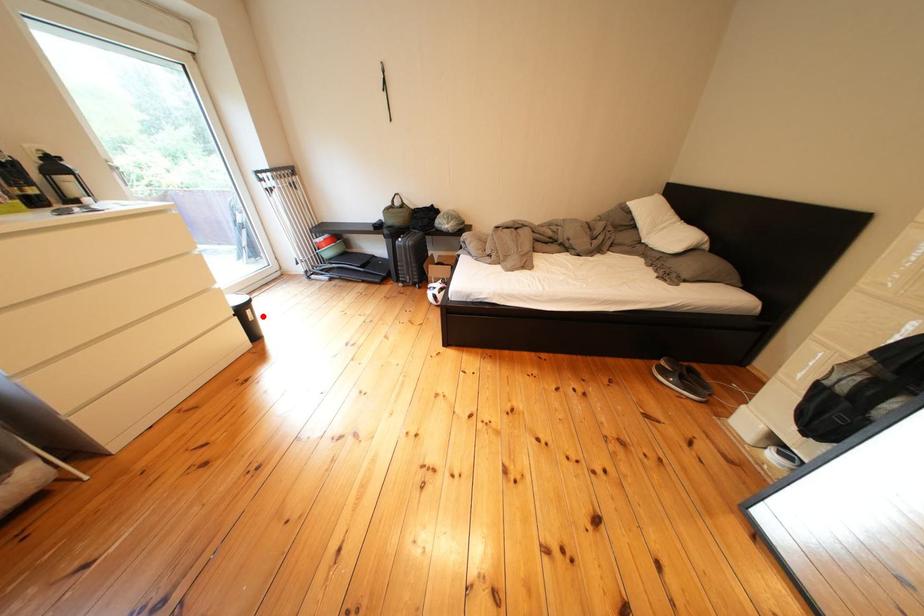
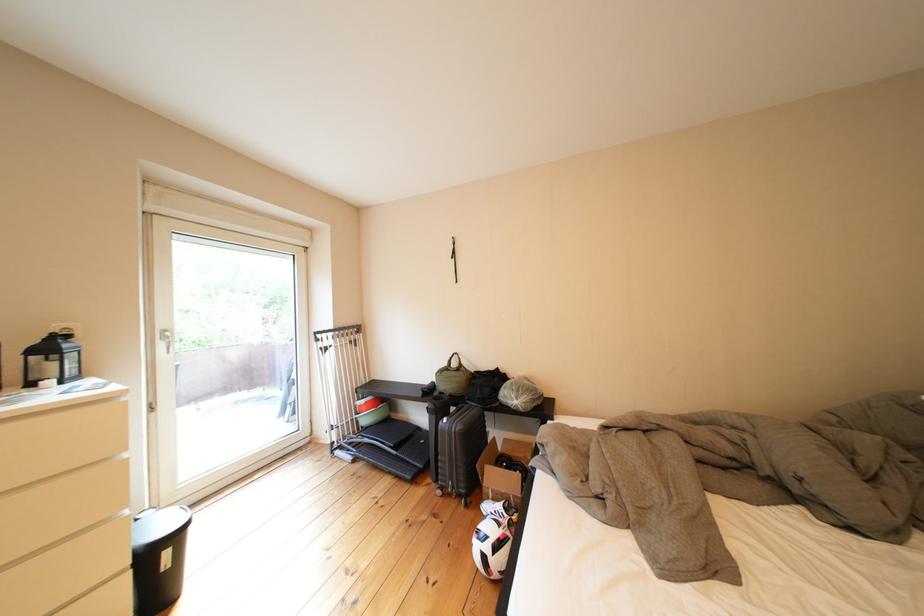
Question: A red point is marked in image1. In image2, is the corresponding 3D point closer to the camera or farther? Reply with the corresponding letter.

Choices:
 (A) The corresponding 3D point is closer.
 (B) The corresponding 3D point is farther.

Answer: (B)